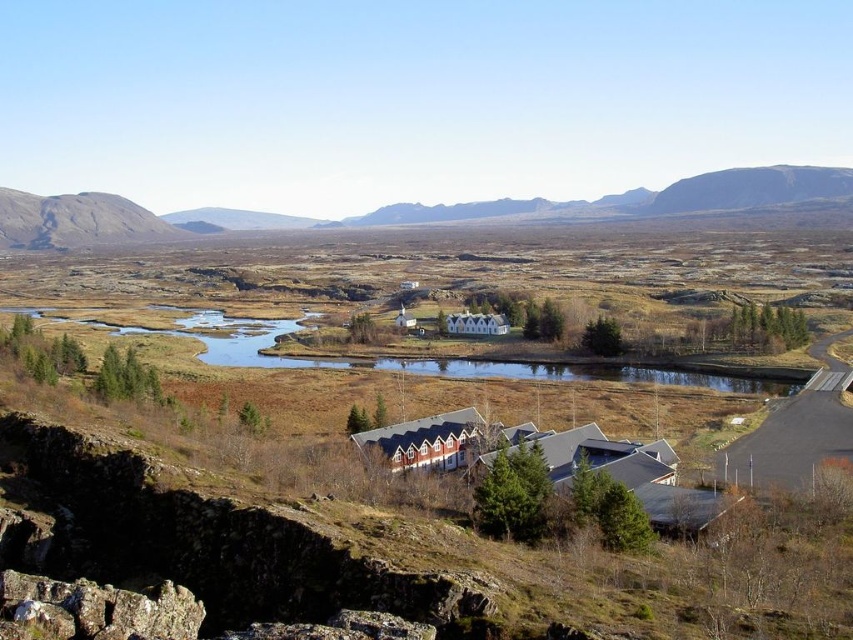
Question: Which object is closer to the camera taking this photo?

Choices:
 (A) rugged rock mountain at left
 (B) green grassy lake at center

Answer: (B)

Question: Does green grassy lake at center lie in front of rugged rock mountain at left?

Choices:
 (A) no
 (B) yes

Answer: (B)

Question: Which point appears farthest from the camera in this image?

Choices:
 (A) (601, 436)
 (B) (108, 195)

Answer: (B)

Question: In this image, where is green grassy lake at center located relative to rugged rock mountain at left?

Choices:
 (A) below
 (B) above

Answer: (A)

Question: Which object is the farthest from the green grassy lake at center?

Choices:
 (A) blue corrugated metal building at center
 (B) rugged rock mountain at left

Answer: (B)

Question: Does blue corrugated metal building at center have a lesser width compared to green grassy lake at center?

Choices:
 (A) no
 (B) yes

Answer: (B)